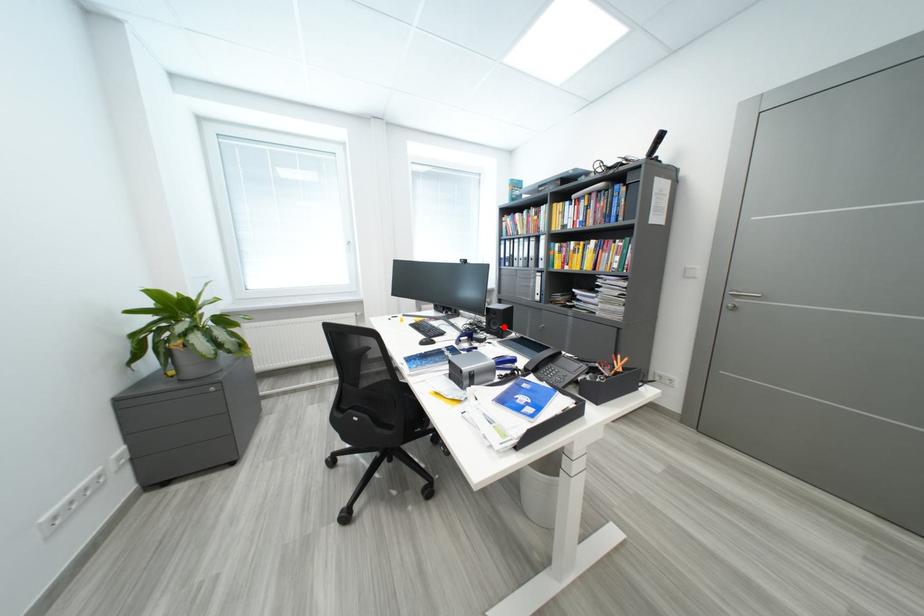
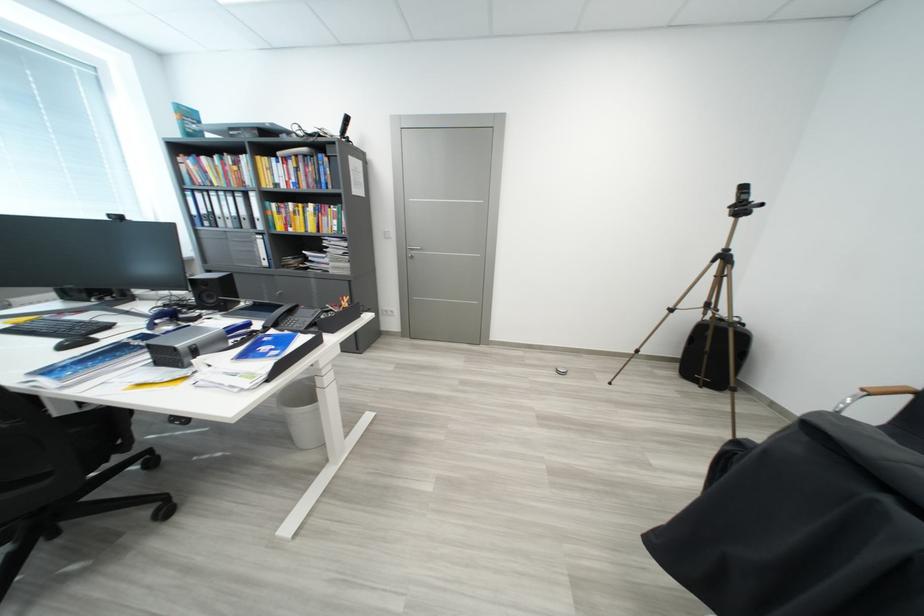
Find the pixel in the second image that matches the highlighted location in the first image.

(220, 300)